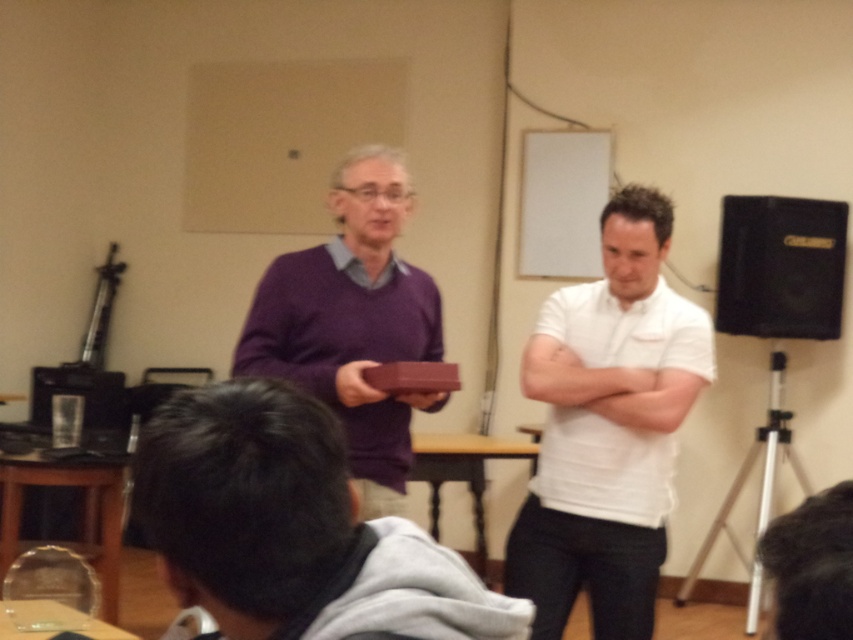
Can you confirm if matte purple sweater at center is shorter than black leather speaker at right?

Correct, matte purple sweater at center is not as tall as black leather speaker at right.

Measure the distance between matte purple sweater at center and black leather speaker at right.

matte purple sweater at center is 4.22 meters away from black leather speaker at right.

Is point (341, 632) positioned after point (729, 236)?

No.

Where is `matte purple sweater at center`? matte purple sweater at center is located at coordinates (293, 529).

The width and height of the screenshot is (853, 640). What do you see at coordinates (293, 529) in the screenshot? I see `matte purple sweater at center` at bounding box center [293, 529].

Which of these two, matte purple sweater at center or white cotton shirt at center, stands taller?

Standing taller between the two is white cotton shirt at center.

Is point (254, 500) behind point (555, 620)?

No, it is not.

Where is `matte purple sweater at center`? Image resolution: width=853 pixels, height=640 pixels. matte purple sweater at center is located at coordinates (293, 529).

Does white cotton shirt at center appear on the left side of purple matte sweater at center?

Incorrect, white cotton shirt at center is not on the left side of purple matte sweater at center.

Who is shorter, white cotton shirt at center or purple matte sweater at center?

Standing shorter between the two is purple matte sweater at center.

Is point (651, 340) closer to viewer compared to point (344, 256)?

No, it is not.

At what (x,y) coordinates should I click in order to perform the action: click on white cotton shirt at center. Please return your answer as a coordinate pair (x, y). This screenshot has height=640, width=853. Looking at the image, I should click on (607, 428).